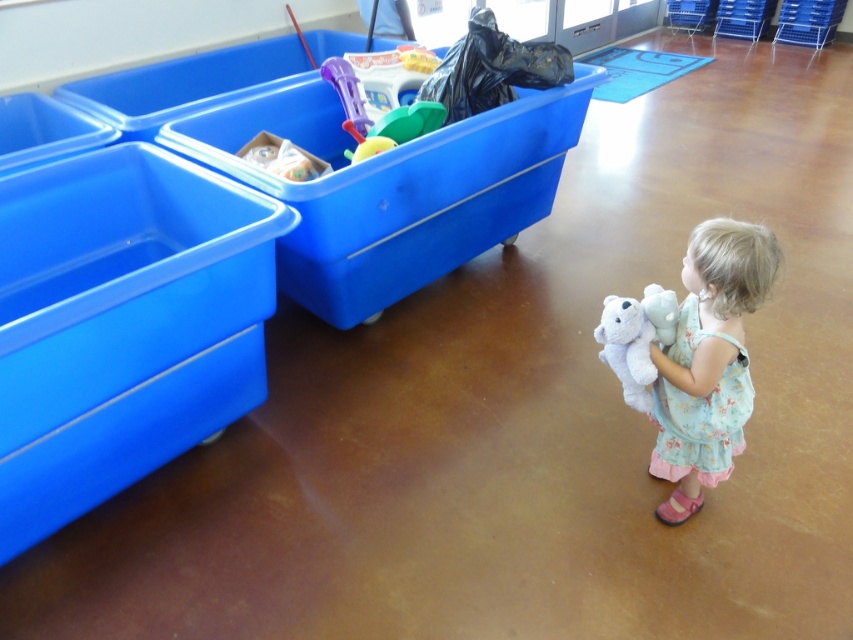
Question: Among these points, which one is nearest to the camera?

Choices:
 (A) [1, 301]
 (B) [740, 275]

Answer: (B)

Question: Is blue plastic bin at left below white plush teddy bear at lower right?

Choices:
 (A) yes
 (B) no

Answer: (B)

Question: Based on their relative distances, which object is farther from the fluffy cotton dress at lower right?

Choices:
 (A) blue plastic bin at left
 (B) white plush teddy bear at lower right

Answer: (A)

Question: Which of these objects is positioned closest to the white plush teddy bear at lower right?

Choices:
 (A) fluffy cotton dress at lower right
 (B) blue plastic bin at left

Answer: (A)

Question: Is fluffy cotton dress at lower right in front of white plush teddy bear at lower right?

Choices:
 (A) yes
 (B) no

Answer: (A)

Question: Is the position of blue plastic bin at left more distant than that of white plush teddy bear at lower right?

Choices:
 (A) no
 (B) yes

Answer: (A)